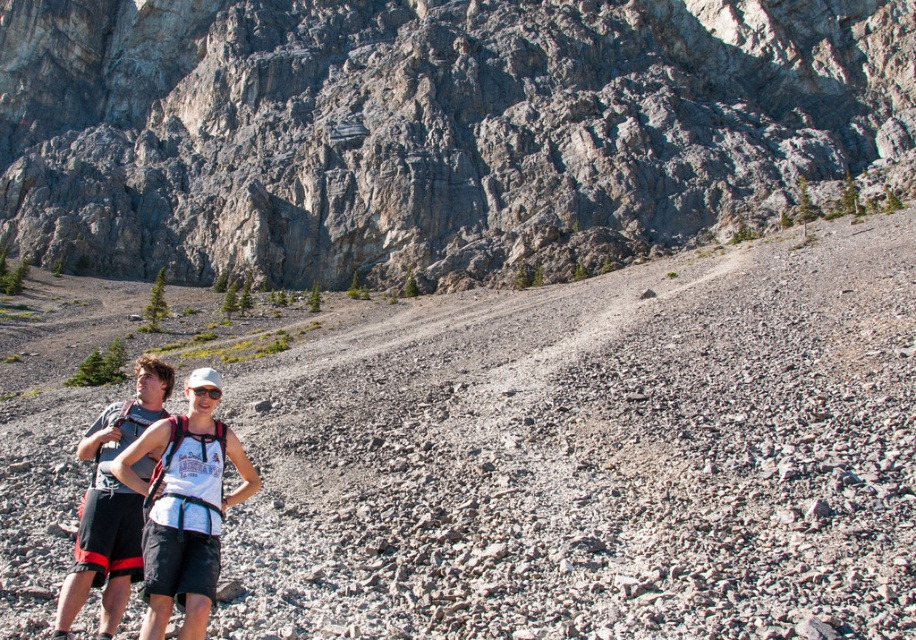
Question: Among these objects, which one is nearest to the camera?

Choices:
 (A) gray rocky mountain at upper center
 (B) white mesh tank top at center

Answer: (B)

Question: Is gray rocky mountain at upper center wider than white mesh tank top at center?

Choices:
 (A) no
 (B) yes

Answer: (B)

Question: Is gray rocky mountain at upper center smaller than white mesh tank top at center?

Choices:
 (A) yes
 (B) no

Answer: (B)

Question: Which of the following is the closest to the observer?

Choices:
 (A) gray rocky mountain at upper center
 (B) white mesh tank top at center

Answer: (B)

Question: Does gray rocky mountain at upper center appear on the left side of white mesh tank top at center?

Choices:
 (A) no
 (B) yes

Answer: (B)